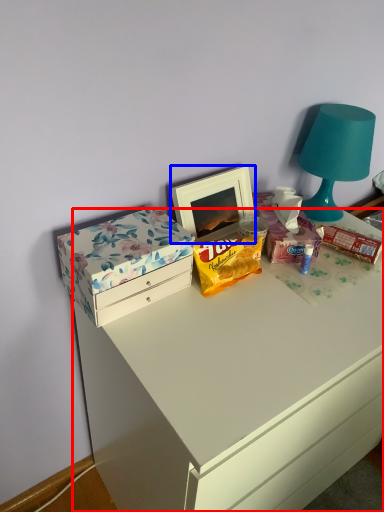
Question: Which of the following is the closest to the observer, desk (highlighted by a red box) or picture frame (highlighted by a blue box)?

Choices:
 (A) desk
 (B) picture frame

Answer: (A)